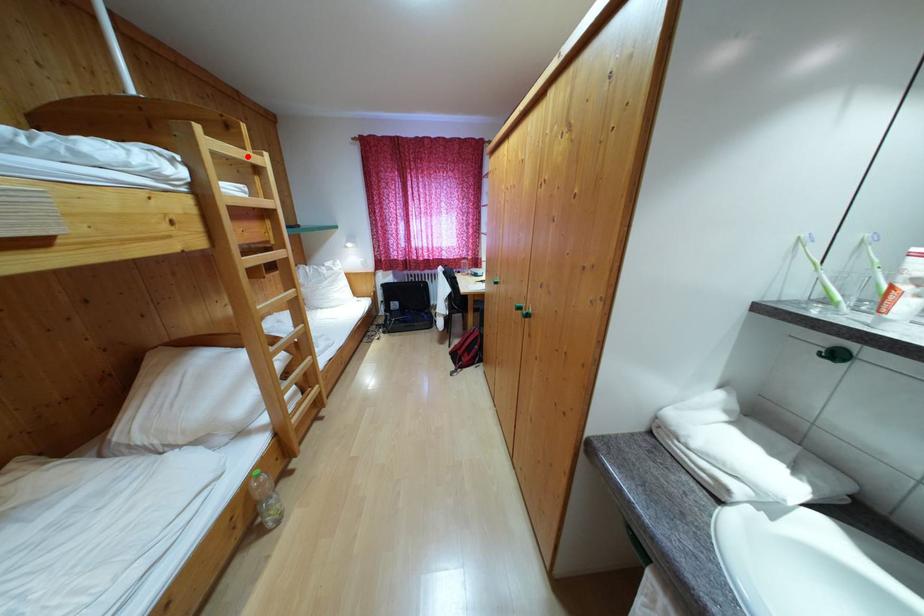
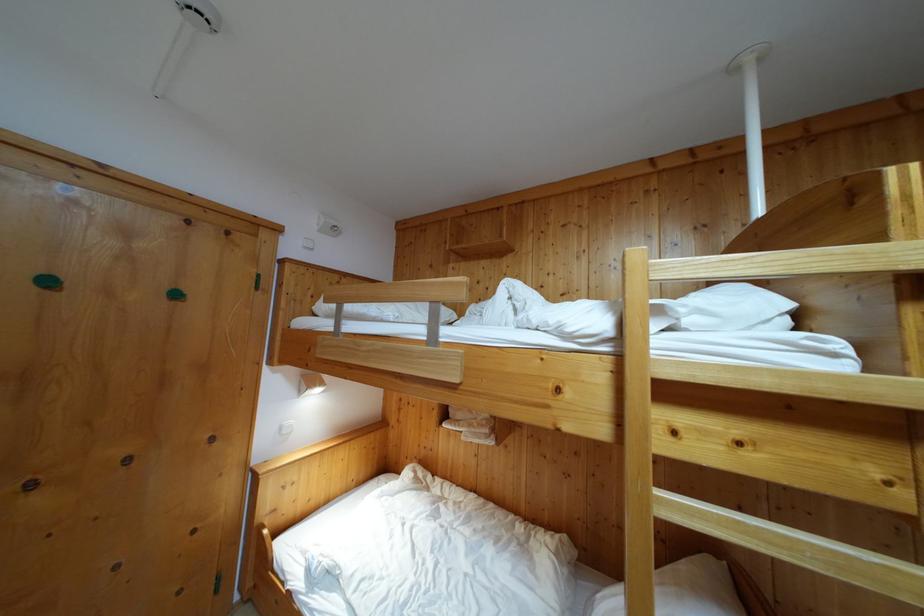
Question: I am providing you with two images of the same scene from different viewpoints. In image1, a red point is highlighted. Considering the same 3D point in image2, which of the following is correct?

Choices:
 (A) It is closer
 (B) It is farther

Answer: (B)